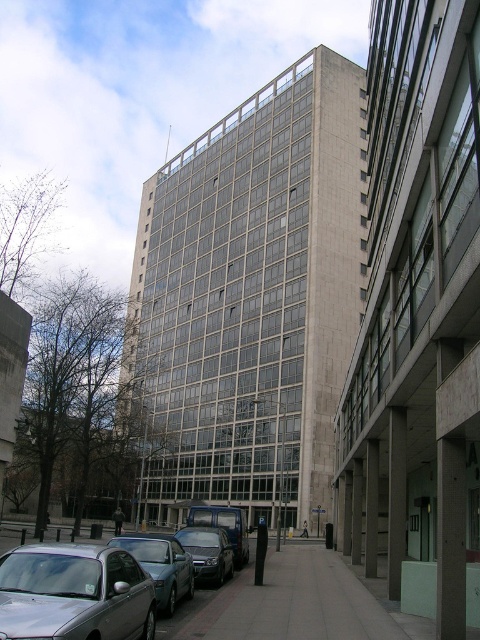
You are a delivery person trying to park your 2.5 meter wide van next to the shiny black sedan at center. The gray concrete pavement at lower center is the only available space. Can your van fit alongside the sedan without overlapping?

The gray concrete pavement at lower center has a larger width than the shiny black sedan at center, so the van can fit alongside the sedan as long as there is enough space remaining after accounting for the sedan.

You are standing on the sidewalk in front of the modern high rise building. You see two points marked on the building facade. The first point is at coordinate point (269, 614) and the second is at point (204, 536). Which point is closer to you?

Point (269, 614) is closer to the viewer than point (204, 536).